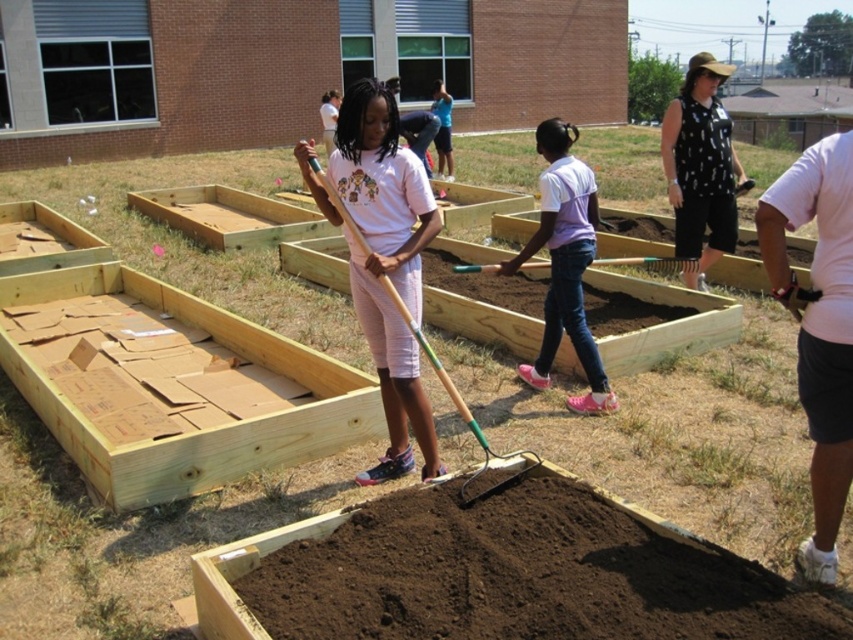
Question: Can you confirm if pink cotton shirt at right is smaller than pink fabric shirt at center?

Choices:
 (A) yes
 (B) no

Answer: (A)

Question: Where is pink cotton shirt at right located in relation to wooden shovel at center in the image?

Choices:
 (A) right
 (B) left

Answer: (A)

Question: Is pink fabric shirt at center above wooden shovel at center?

Choices:
 (A) no
 (B) yes

Answer: (B)

Question: Which point appears closest to the camera in this image?

Choices:
 (A) (676, 260)
 (B) (587, 227)
 (C) (822, 509)

Answer: (C)

Question: Which is farther from the pink fabric shirt at center?

Choices:
 (A) matte pink shirt at center
 (B) black dotted tank top at upper right
 (C) wooden shovel at center

Answer: (B)

Question: Which of the following is the closest to the observer?

Choices:
 (A) (326, 189)
 (B) (567, 300)
 (C) (692, 264)
 (D) (663, 156)

Answer: (A)